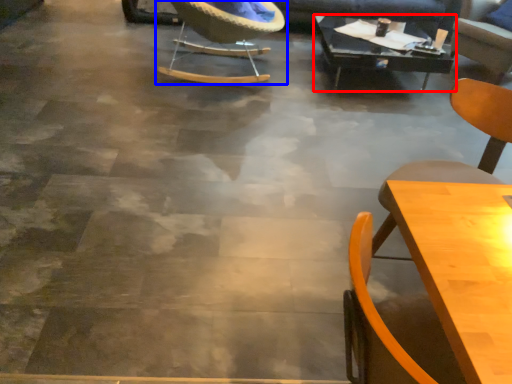
Question: Which object appears closest to the camera in this image, table (highlighted by a red box) or chair (highlighted by a blue box)?

Choices:
 (A) table
 (B) chair

Answer: (B)